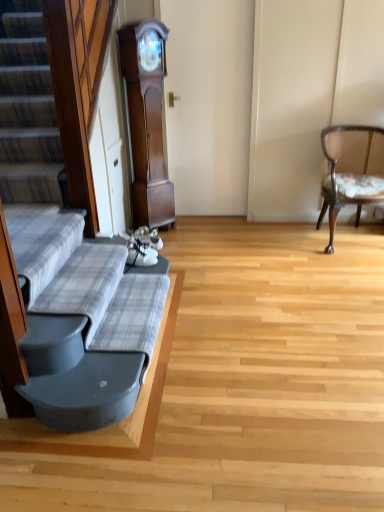
What are the coordinates of `free point in front of plaid fabric couch at left` in the screenshot? It's located at (160, 449).